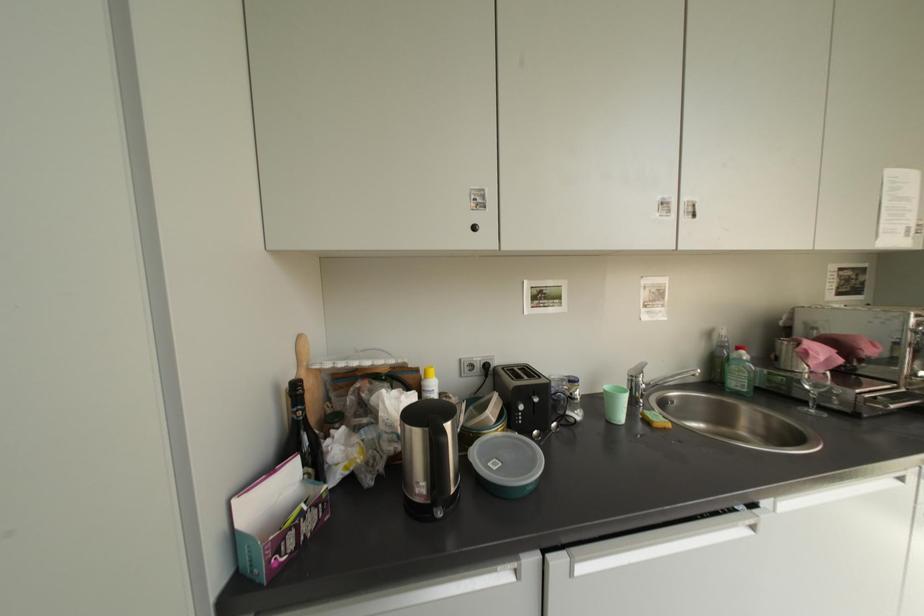
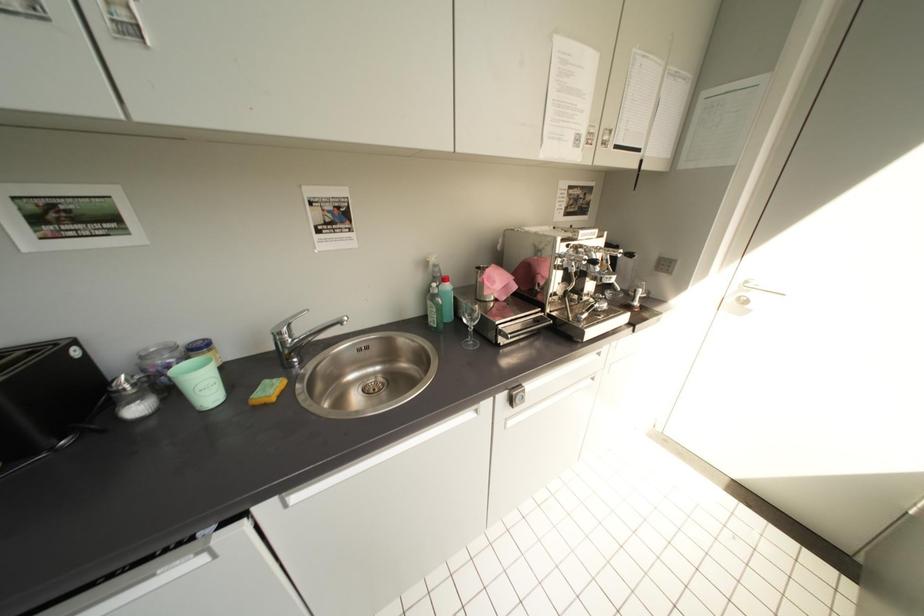
Question: Which direction would the cameraman need to move to produce the second image? Reply with the corresponding letter.

Choices:
 (A) Left
 (B) Right
 (C) Forward
 (D) Backward

Answer: (B)